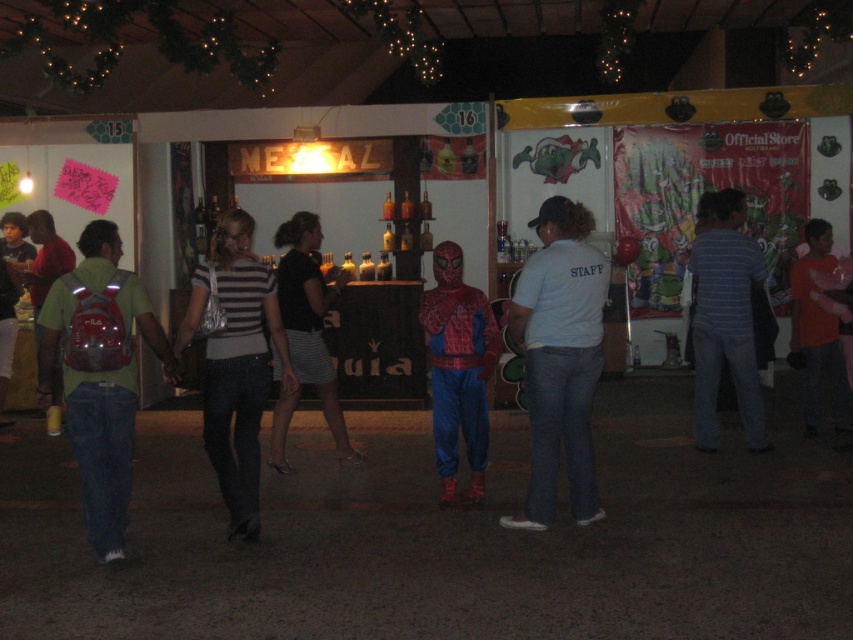
From the picture: Who is lower down, white cotton shirt at center or striped fabric skirt at center?

white cotton shirt at center is lower down.

This screenshot has height=640, width=853. What do you see at coordinates (560, 358) in the screenshot?
I see `white cotton shirt at center` at bounding box center [560, 358].

You are a GUI agent. You are given a task and a screenshot of the screen. Output one action in this format:
    pyautogui.click(x=<x>, y=<y>)
    Task: Click on the white cotton shirt at center
    This screenshot has width=853, height=640.
    Given the screenshot: What is the action you would take?
    pyautogui.click(x=560, y=358)

Identify the location of white cotton shirt at center. (560, 358).

Which is below, striped fabric skirt at center or orange cotton shirt at right?

Positioned lower is striped fabric skirt at center.

Which of these two, striped fabric skirt at center or orange cotton shirt at right, stands shorter?

With less height is orange cotton shirt at right.

Identify the location of striped fabric skirt at center. (309, 317).

Is matte red backpack at left smaller than orange cotton shirt at right?

Correct, matte red backpack at left occupies less space than orange cotton shirt at right.

Image resolution: width=853 pixels, height=640 pixels. In order to click on matte red backpack at left in this screenshot , I will do `click(102, 449)`.

I want to click on matte red backpack at left, so click(x=102, y=449).